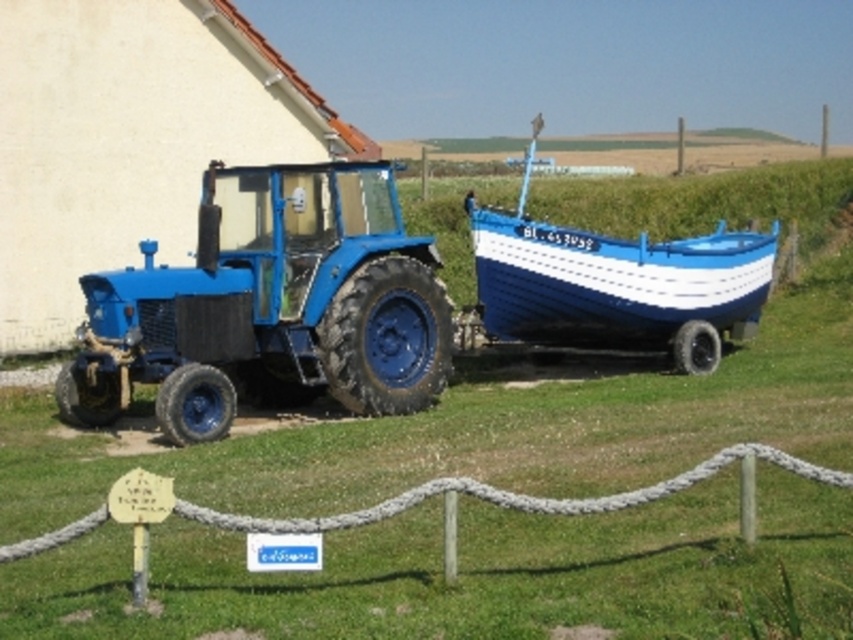
Between matte blue tractor at left and blue painted wood boat at right, which one appears on the left side from the viewer's perspective?

matte blue tractor at left

Which is in front, point (236, 320) or point (665, 330)?

Point (236, 320) is in front.

Find the location of a particular element. This screenshot has width=853, height=640. matte blue tractor at left is located at coordinates (270, 307).